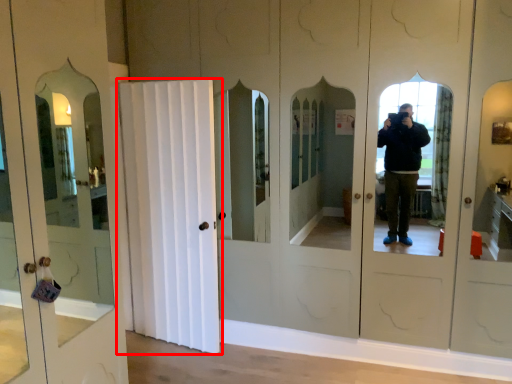
Question: Observing the image, what is the correct spatial positioning of door (annotated by the red box) in reference to door?

Choices:
 (A) left
 (B) right

Answer: (B)